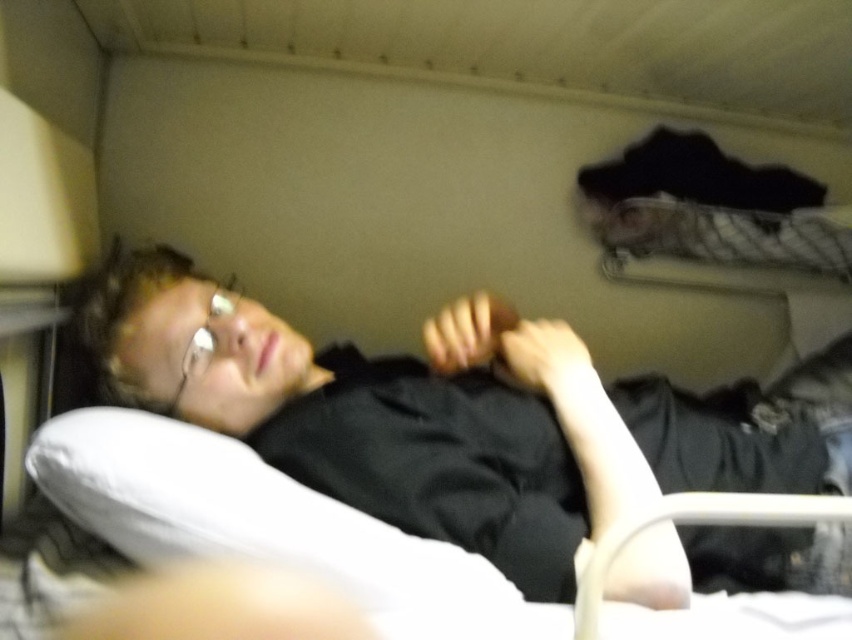
Does point (158, 288) come behind point (44, 476)?

Yes, point (158, 288) is farther from viewer.

At what (x,y) coordinates should I click in order to perform the action: click on black matte shirt at center. Please return your answer as a coordinate pair (x, y). The width and height of the screenshot is (852, 640). Looking at the image, I should click on (430, 417).

Where is `black matte shirt at center`? black matte shirt at center is located at coordinates (430, 417).